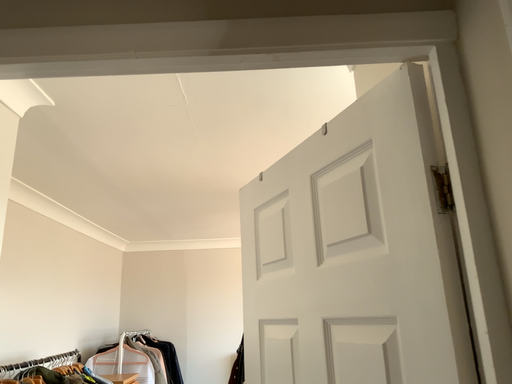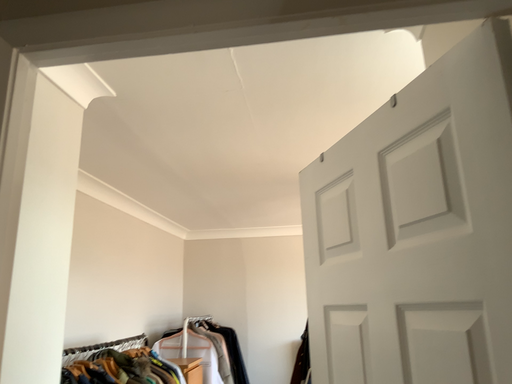
Question: Which way did the camera rotate in the video?

Choices:
 (A) rotated right
 (B) rotated left

Answer: (B)